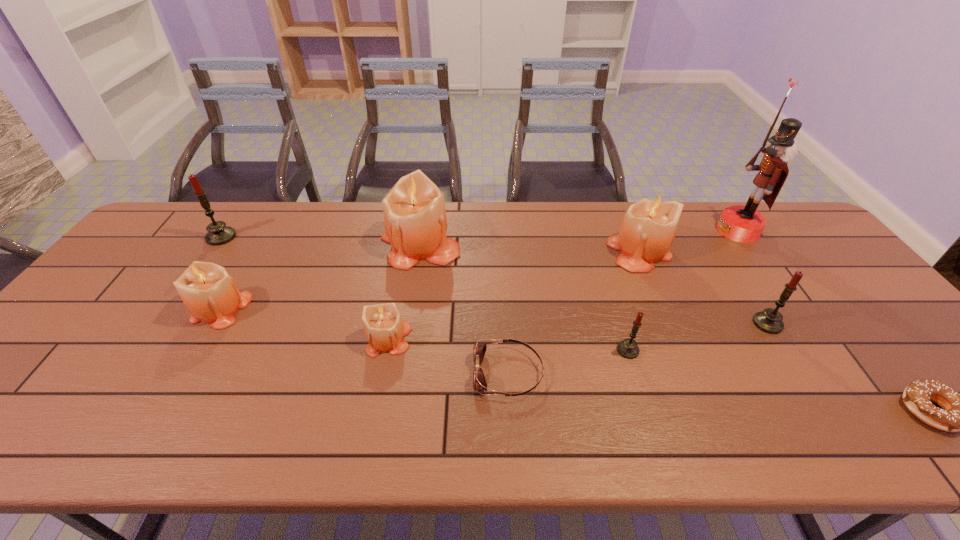
The width and height of the screenshot is (960, 540). I want to click on vacant area at the near edge, so click(x=751, y=446).

Locate an element on the screen. This screenshot has height=540, width=960. blank space at the left edge is located at coordinates 147,301.

Locate an element on the screen. Image resolution: width=960 pixels, height=540 pixels. vacant space at the right edge of the desktop is located at coordinates (832, 300).

What are the coordinates of `vacant space at the far right corner of the desktop` in the screenshot? It's located at (819, 245).

Find the location of a particular element. This screenshot has width=960, height=540. free point between the goggles and the biggest beige candle is located at coordinates (464, 309).

Identify the location of free space between the biggest beige candle and the goggles. Image resolution: width=960 pixels, height=540 pixels. (464, 309).

Locate an element on the screen. This screenshot has width=960, height=540. vacant space in between the goggles and the smallest beige candle is located at coordinates (448, 356).

Find the location of `vacant space that's between the smallest beige candle and the biggest beige candle`. vacant space that's between the smallest beige candle and the biggest beige candle is located at coordinates (404, 292).

Where is `unoccupied position between the biggest beige candle and the smallest beige candle`? The width and height of the screenshot is (960, 540). unoccupied position between the biggest beige candle and the smallest beige candle is located at coordinates (404, 292).

The width and height of the screenshot is (960, 540). Identify the location of empty space that is in between the second candle from left to right and the smallest beige candle. (305, 323).